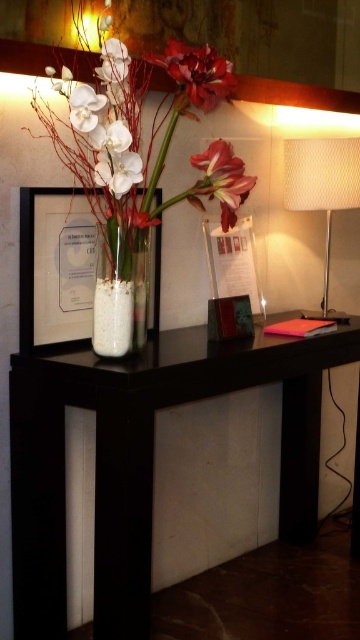
You are a delivery person who needs to place a package on the black matte table at center. You are currently standing 5 feet away from the table. Can you reach the table without moving closer?

The distance between you and the black matte table at center is 5 feet, and the table is 4.53 feet away. Since 5 feet is slightly more than 4.53 feet, you would need to move about 0.47 feet closer to place the package on the black matte table at center.

Based on the photo, you are standing in the reception area and want to place a small potted plant on the console table. The potted plant requires a spot that is exactly 5.50 feet away from where you are standing. Is the point at coordinates point (48,604) on the console table suitable for placing the potted plant?

The point at coordinates point (48,604) on the console table is exactly 5.50 feet away from the camera, so yes, it is suitable for placing the potted plant as it meets the required distance.